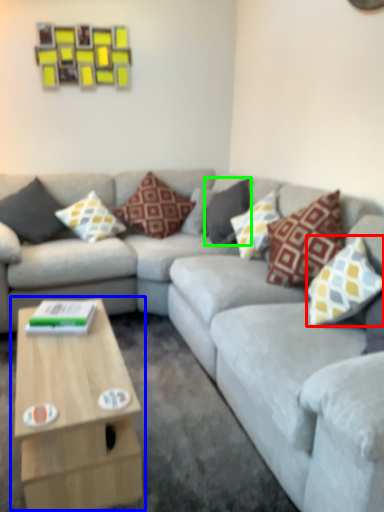
Question: Which object is the farthest from pillow (highlighted by a red box)? Choose among these: coffee table (highlighted by a blue box) or pillow (highlighted by a green box).

Choices:
 (A) coffee table
 (B) pillow

Answer: (B)